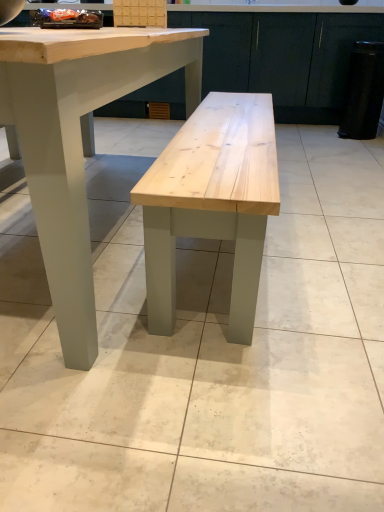
What do you see at coordinates (286, 58) in the screenshot? I see `matte wood cabinet at center` at bounding box center [286, 58].

I want to click on matte wood cabinet at center, so point(286,58).

What do you see at coordinates (78, 140) in the screenshot?
I see `natural wood table at center` at bounding box center [78, 140].

The width and height of the screenshot is (384, 512). What are the coordinates of `natural wood table at center` in the screenshot? It's located at (78, 140).

The width and height of the screenshot is (384, 512). Find the location of `matte wood cabinet at center`. matte wood cabinet at center is located at coordinates (286, 58).

In the image, is natural wood table at center on the left side or the right side of matte wood cabinet at center?

Clearly, natural wood table at center is on the left of matte wood cabinet at center in the image.

Between natural wood table at center and matte wood cabinet at center, which one is positioned in front?

Positioned in front is natural wood table at center.

Which is farther from the camera, [29,91] or [283,105]?

Point [283,105]

Based on the photo, from the image's perspective, which one is positioned higher, natural wood table at center or matte wood cabinet at center?

matte wood cabinet at center.

From a real-world perspective, is natural wood table at center on top of matte wood cabinet at center?

Result: Actually, natural wood table at center is physically below matte wood cabinet at center in the real world.

Considering the relative sizes of natural wood table at center and matte wood cabinet at center in the image provided, is natural wood table at center wider than matte wood cabinet at center?

Yes, natural wood table at center is wider than matte wood cabinet at center.

Can you confirm if natural wood table at center is shorter than matte wood cabinet at center?

Indeed, natural wood table at center has a lesser height compared to matte wood cabinet at center.

Considering the sizes of objects natural wood table at center and matte wood cabinet at center in the image provided, who is bigger, natural wood table at center or matte wood cabinet at center?

Bigger between the two is natural wood table at center.

Do you think natural wood table at center is within matte wood cabinet at center, or outside of it?

natural wood table at center is not enclosed by matte wood cabinet at center.

Are natural wood table at center and matte wood cabinet at center located far from each other?

Yes.

Is natural wood table at center oriented away from matte wood cabinet at center?

That's not correct — natural wood table at center is not looking away from matte wood cabinet at center.

This screenshot has width=384, height=512. Find the location of `table below the matte wood cabinet at center (from the image's perspective)`. table below the matte wood cabinet at center (from the image's perspective) is located at coordinates (78, 140).

Between matte wood cabinet at center and natural wood table at center, which one appears on the left side from the viewer's perspective?

From the viewer's perspective, natural wood table at center appears more on the left side.

Between matte wood cabinet at center and natural wood table at center, which one is positioned in front?

natural wood table at center is more forward.

Considering the points (333, 46) and (53, 122), which point is behind, point (333, 46) or point (53, 122)?

The point (333, 46) is farther.

From the image's perspective, does matte wood cabinet at center appear lower than natural wood table at center?

No, from the image's perspective, matte wood cabinet at center is not beneath natural wood table at center.

From a real-world perspective, relative to natural wood table at center, is matte wood cabinet at center vertically above or below?

matte wood cabinet at center is above natural wood table at center.

Can you confirm if matte wood cabinet at center is wider than natural wood table at center?

No.

Can you confirm if matte wood cabinet at center is shorter than natural wood table at center?

No, matte wood cabinet at center is not shorter than natural wood table at center.

Who is bigger, matte wood cabinet at center or natural wood table at center?

Bigger between the two is natural wood table at center.

Is natural wood table at center a part of matte wood cabinet at center?

No, natural wood table at center is not a part of matte wood cabinet at center.

Is matte wood cabinet at center far from natural wood table at center?

Indeed, matte wood cabinet at center is not near natural wood table at center.

Does matte wood cabinet at center turn towards natural wood table at center?

Yes, matte wood cabinet at center is facing natural wood table at center.

What's the angular difference between matte wood cabinet at center and natural wood table at center's facing directions?

They differ by 178 degrees in their facing directions.

Identify the location of cabinetry above the natural wood table at center (from a real-world perspective). Image resolution: width=384 pixels, height=512 pixels. click(286, 58).

Locate an element on the screen. table below the matte wood cabinet at center (from a real-world perspective) is located at coordinates (78, 140).

The height and width of the screenshot is (512, 384). I want to click on cabinetry that appears behind the natural wood table at center, so click(x=286, y=58).